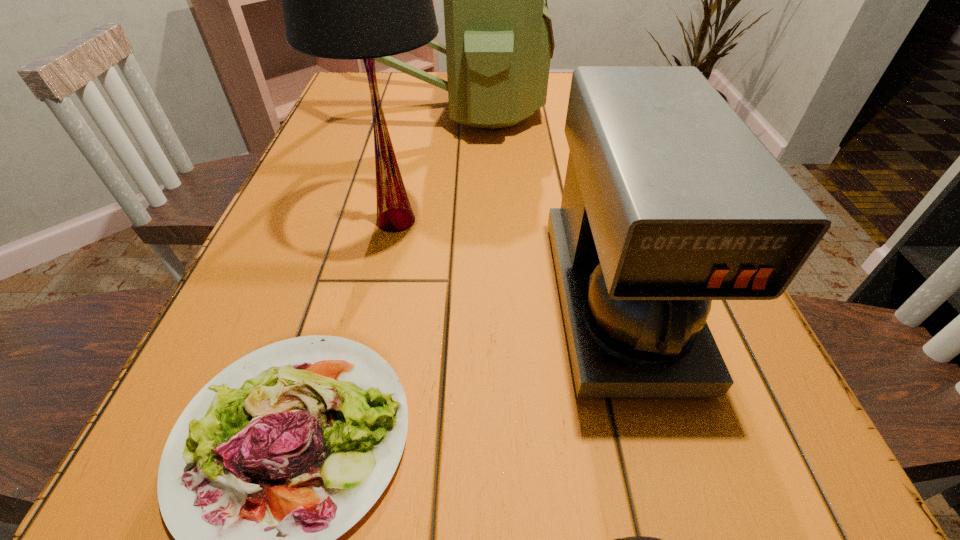
The image size is (960, 540). Identify the location of object present at the far left corner. (499, 39).

This screenshot has width=960, height=540. What are the coordinates of `free spot at the far edge of the desktop` in the screenshot? It's located at (398, 87).

Find the location of a particular element. This screenshot has width=960, height=540. vacant space at the near edge is located at coordinates (603, 498).

In the image, there is a desktop. What are the coordinates of `free space at the left edge` in the screenshot? It's located at (148, 483).

I want to click on free point at the right edge, so click(710, 434).

Image resolution: width=960 pixels, height=540 pixels. Find the location of `vacant space that is in between the coffee maker and the lampshade`. vacant space that is in between the coffee maker and the lampshade is located at coordinates (507, 260).

Identify the location of empty space between the backpack and the lampshade. Image resolution: width=960 pixels, height=540 pixels. (424, 166).

Locate an element on the screen. The height and width of the screenshot is (540, 960). vacant area between the backpack and the lampshade is located at coordinates (424, 166).

The height and width of the screenshot is (540, 960). What are the coordinates of `free space between the third tallest object and the lampshade` in the screenshot? It's located at (507, 260).

Locate an element on the screen. This screenshot has height=540, width=960. free space between the third tallest object and the farthest object is located at coordinates (535, 205).